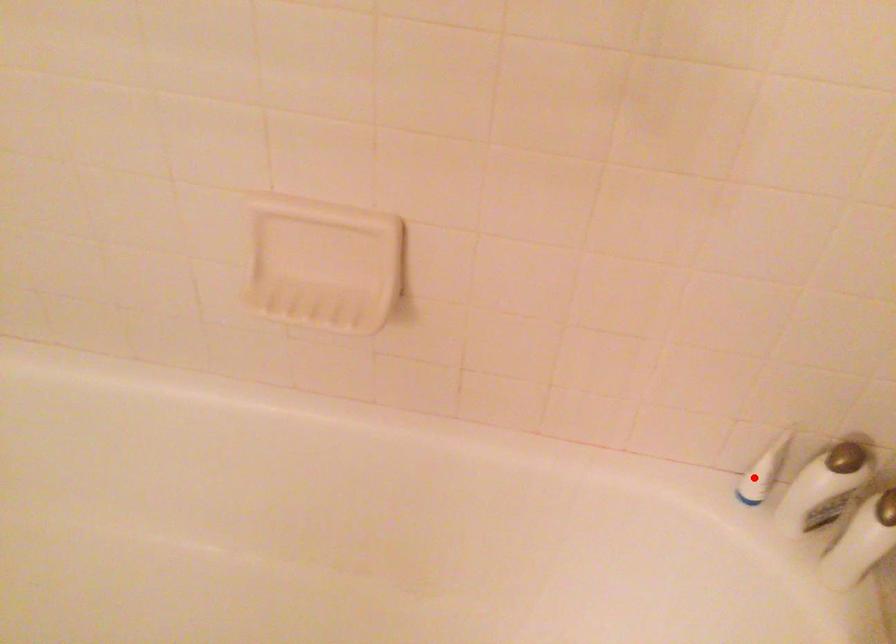
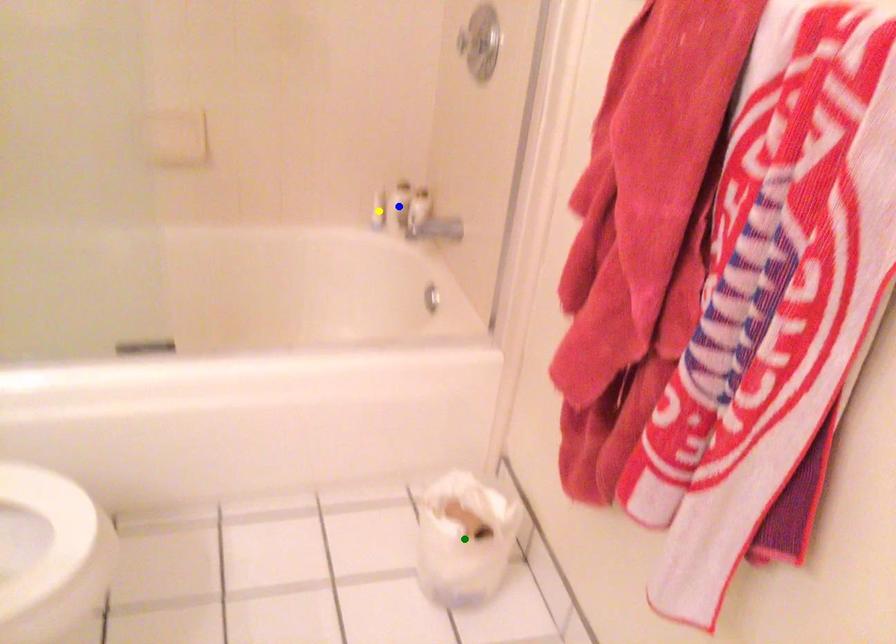
Question: I am providing you with two images of the same scene from different viewpoints. A red point is marked on the first image. You are given multiple points on the second image. Which point in image 2 represents the same 3d spot as the red point in image 1?

Choices:
 (A) blue point
 (B) yellow point
 (C) green point

Answer: (B)